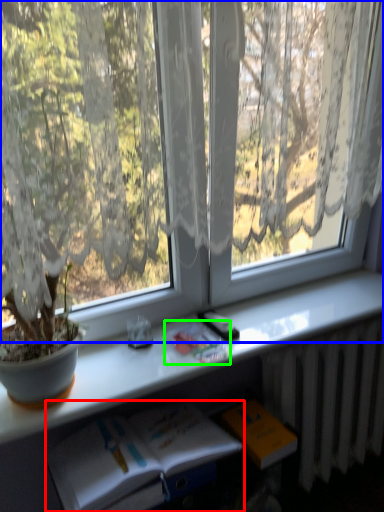
Question: Which object is positioned farthest from book (highlighted by a red box)? Select from window (highlighted by a blue box) and book (highlighted by a green box).

Choices:
 (A) window
 (B) book

Answer: (A)